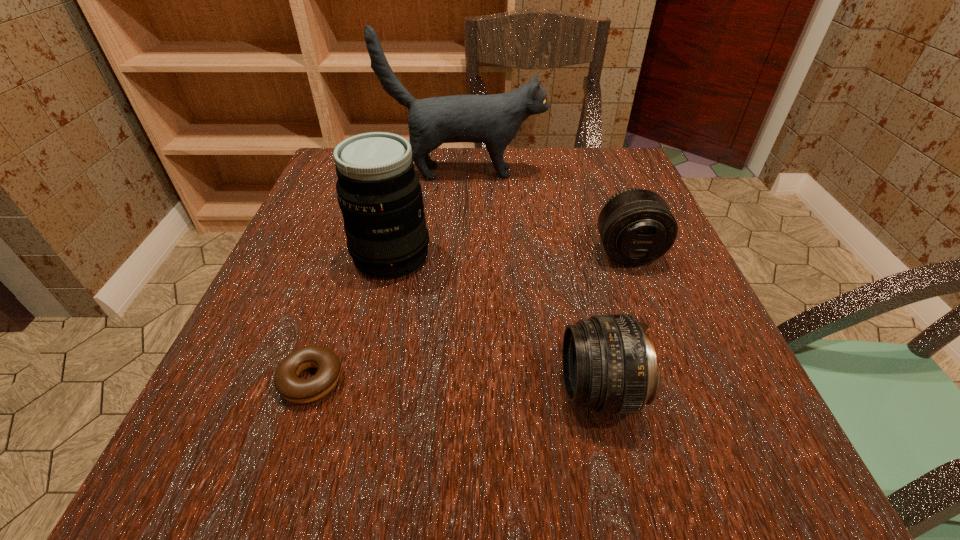
Where is `free location at the near edge`? The height and width of the screenshot is (540, 960). free location at the near edge is located at coordinates (415, 456).

In the image, there is a desktop. What are the coordinates of `free space at the left edge` in the screenshot? It's located at (223, 408).

In order to click on vacant space at the right edge in this screenshot , I will do `click(650, 293)`.

This screenshot has height=540, width=960. In the image, there is a desktop. Find the location of `vacant space at the near right corner`. vacant space at the near right corner is located at coordinates (779, 500).

In order to click on free spot between the doughnut and the nearest telephoto lens in this screenshot , I will do `click(455, 385)`.

Identify the location of free space between the leftmost telephoto lens and the shortest object. The height and width of the screenshot is (540, 960). (351, 318).

Where is `free space that is in between the shortest object and the leftmost telephoto lens`? free space that is in between the shortest object and the leftmost telephoto lens is located at coordinates (351, 318).

This screenshot has width=960, height=540. I want to click on blank region between the cat and the leftmost telephoto lens, so click(428, 214).

Image resolution: width=960 pixels, height=540 pixels. I want to click on vacant region between the doughnut and the fourth shortest object, so click(351, 318).

You are a GUI agent. You are given a task and a screenshot of the screen. Output one action in this format:
    pyautogui.click(x=<x>, y=<y>)
    Task: Click on the free area in between the farthest object and the nearest telephoto lens
    
    Given the screenshot: What is the action you would take?
    pyautogui.click(x=532, y=281)